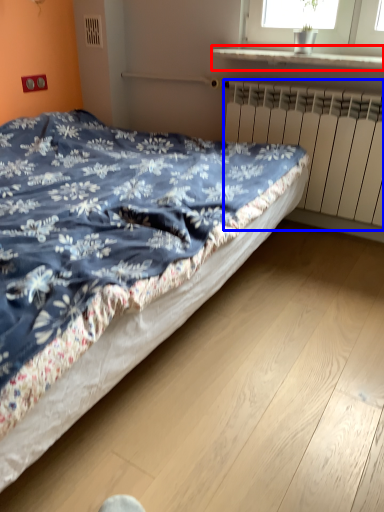
Question: Which object is further to the camera taking this photo, window sill (highlighted by a red box) or radiator (highlighted by a blue box)?

Choices:
 (A) window sill
 (B) radiator

Answer: (B)